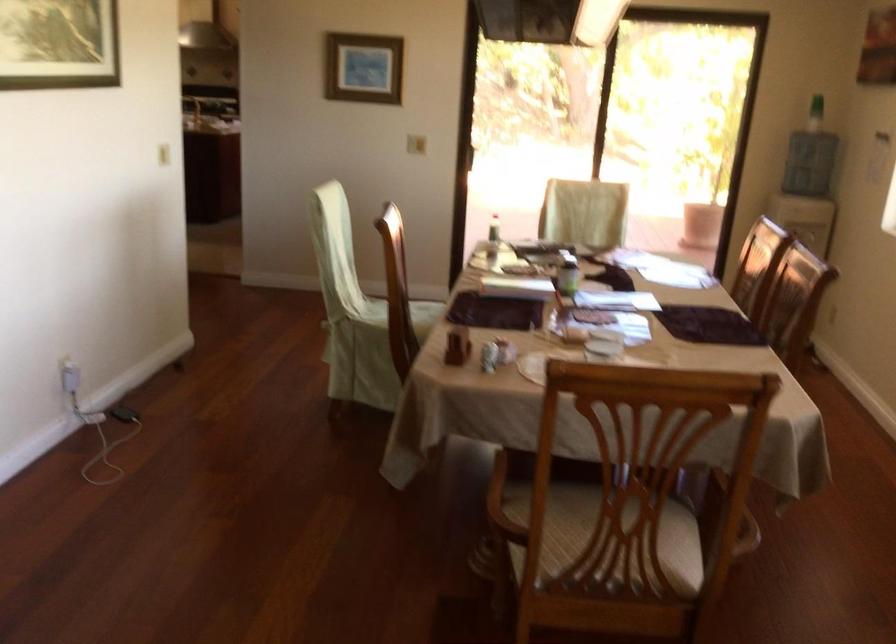
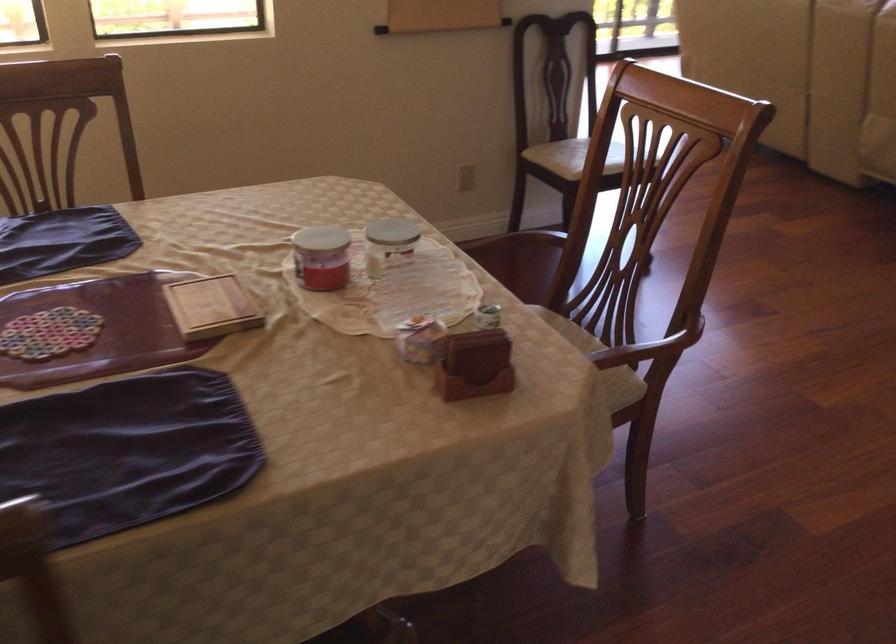
Question: I am providing you with two images of the same scene from different viewpoints. After the viewpoint changes to image2, which objects are now occluded?

Choices:
 (A) small wooden book
 (B) wooden chair armrest
 (C) black water knob
 (D) small gift box

Answer: (B)